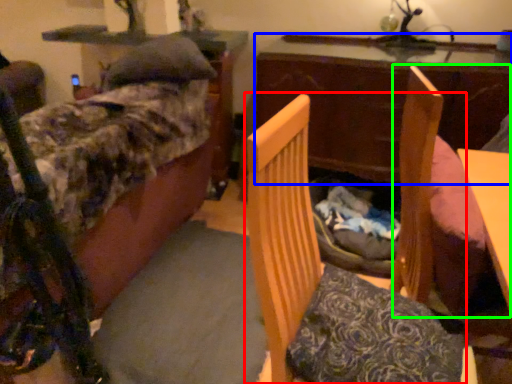
Question: Based on their relative distances, which object is farther from furniture (highlighted by a red box)? Choose from table (highlighted by a blue box) and swivel chair (highlighted by a green box).

Choices:
 (A) table
 (B) swivel chair

Answer: (A)